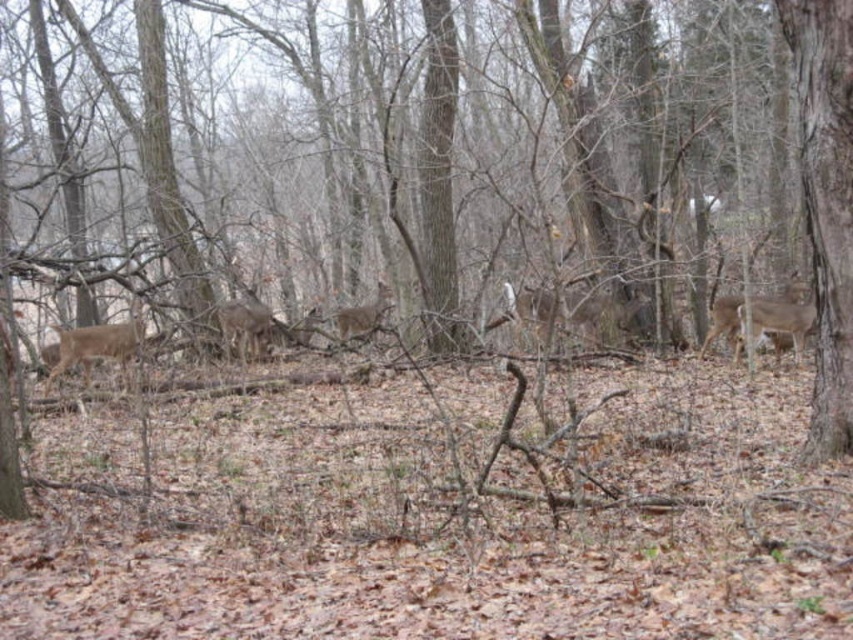
Based on the photo, between brown fur deer at left and brown fur deer at center, which one has more height?

brown fur deer at left

Does brown fur deer at left appear under brown fur deer at center?

Yes.

Locate an element on the screen. This screenshot has height=640, width=853. brown fur deer at left is located at coordinates (97, 344).

Which is above, brown rough bark tree at right or brown matte deer at center?

brown rough bark tree at right

Is brown rough bark tree at right bigger than brown matte deer at center?

Actually, brown rough bark tree at right might be smaller than brown matte deer at center.

The image size is (853, 640). In order to click on brown rough bark tree at right in this screenshot , I will do `click(827, 204)`.

Who is positioned more to the right, brown rough bark tree at right or brown matte/deer at center-right?

From the viewer's perspective, brown matte/deer at center-right appears more on the right side.

Does brown rough bark tree at right appear over brown matte/deer at center-right?

Indeed, brown rough bark tree at right is positioned over brown matte/deer at center-right.

Between point (822, 99) and point (726, 323), which one is positioned behind?

Positioned behind is point (726, 323).

You are a GUI agent. You are given a task and a screenshot of the screen. Output one action in this format:
    pyautogui.click(x=<x>, y=<y>)
    Task: Click on the brown rough bark tree at right
    
    Given the screenshot: What is the action you would take?
    pyautogui.click(x=827, y=204)